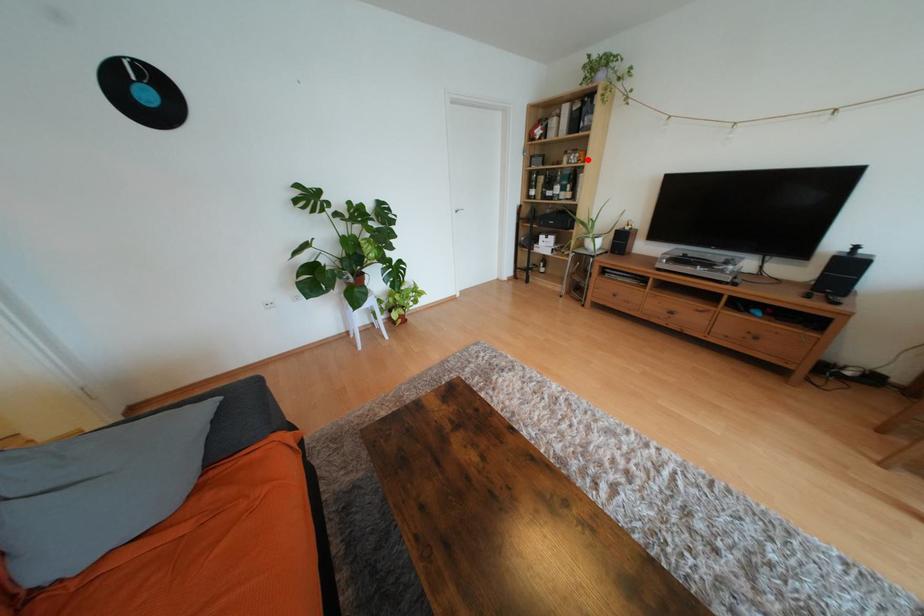
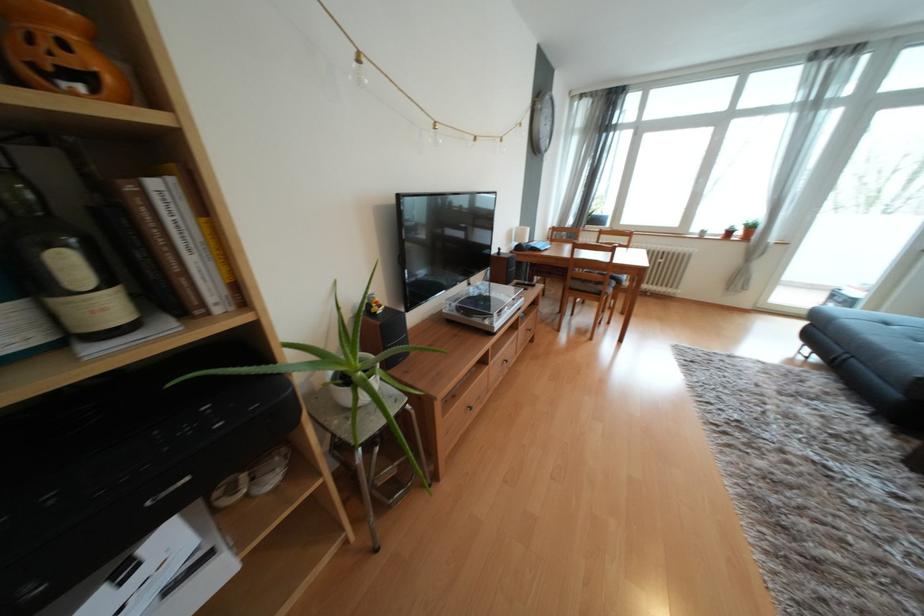
Question: I am providing you with two images of the same scene from different viewpoints. In image1, a red point is highlighted. Considering the same 3D point in image2, which of the following is correct?

Choices:
 (A) It is closer
 (B) It is farther

Answer: (B)